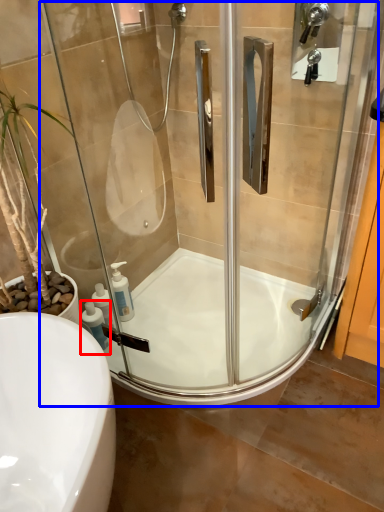
Question: Among these objects, which one is nearest to the camera, soap dispenser (highlighted by a red box) or screen door (highlighted by a blue box)?

Choices:
 (A) soap dispenser
 (B) screen door

Answer: (B)